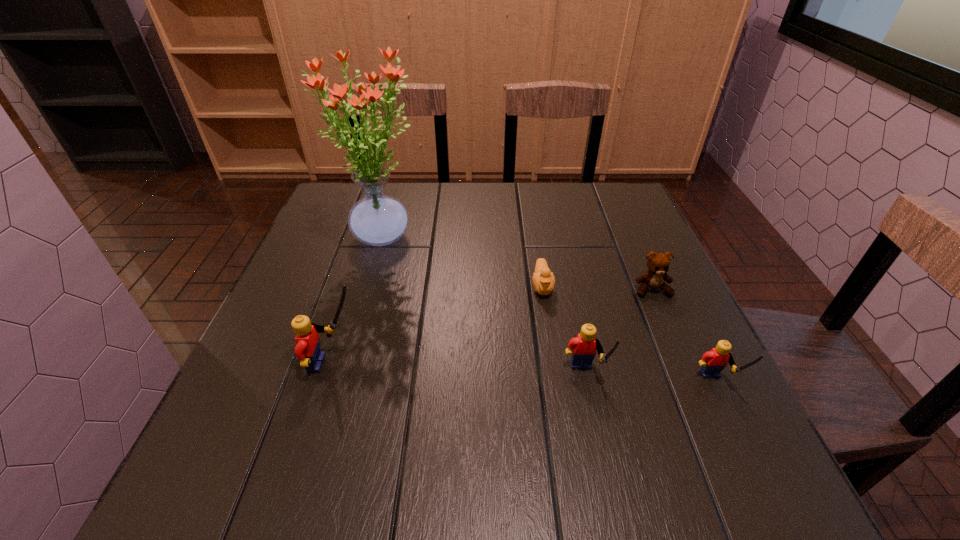
Locate an element on the screen. object at the near right corner is located at coordinates (713, 362).

At what (x,y) coordinates should I click in order to perform the action: click on free space at the far edge of the desktop. Please return your answer as a coordinate pair (x, y). Looking at the image, I should click on (447, 207).

You are a GUI agent. You are given a task and a screenshot of the screen. Output one action in this format:
    pyautogui.click(x=<x>, y=<y>)
    Task: Click on the vacant space at the near edge
    The width and height of the screenshot is (960, 540).
    Given the screenshot: What is the action you would take?
    pyautogui.click(x=562, y=427)

You are a GUI agent. You are given a task and a screenshot of the screen. Output one action in this format:
    pyautogui.click(x=<x>, y=<y>)
    Task: Click on the free space at the left edge of the desktop
    
    Given the screenshot: What is the action you would take?
    pyautogui.click(x=289, y=358)

In the image, there is a desktop. What are the coordinates of `vacant space at the right edge` in the screenshot? It's located at (626, 320).

In the image, there is a desktop. Identify the location of vacant space at the far left corner. (362, 194).

Locate an element on the screen. The image size is (960, 540). vacant space at the far right corner of the desktop is located at coordinates (616, 187).

This screenshot has height=540, width=960. In the image, there is a desktop. Find the location of `free region at the near right corner`. free region at the near right corner is located at coordinates (697, 408).

This screenshot has height=540, width=960. I want to click on vacant space that is in between the leftmost Lego and the shortest Lego, so click(524, 374).

Image resolution: width=960 pixels, height=540 pixels. I want to click on free space between the duckling and the teddy bear, so click(x=597, y=288).